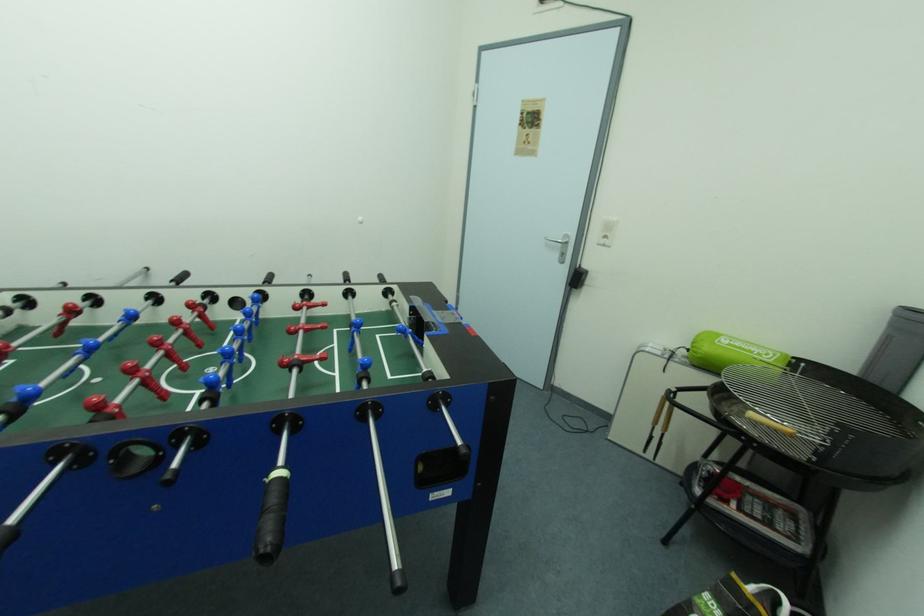
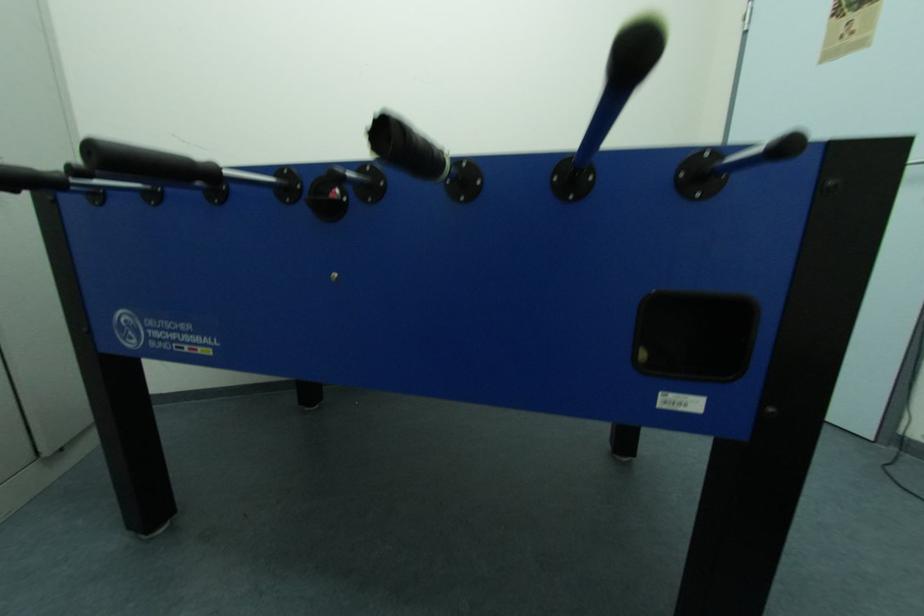
Question: The camera is either moving clockwise (left) or counter-clockwise (right) around the object. The first image is from the beginning of the video and the second image is from the end. Is the camera moving left or right when shooting the video?

Choices:
 (A) Left
 (B) Right

Answer: (B)